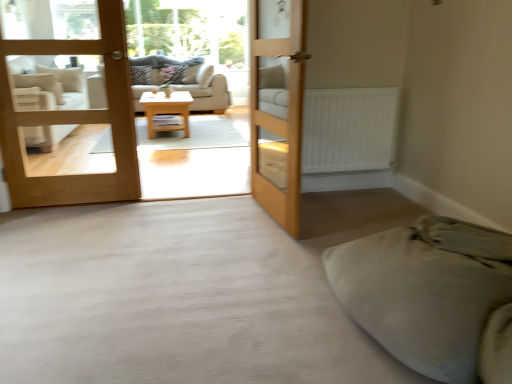
Question: Does light brown wood door at left, the first door from the left, come in front of patterned fabric pillow at center, the first pillow in the left-to-right sequence?

Choices:
 (A) no
 (B) yes

Answer: (B)

Question: Does light brown wood door at left, the first door from the left, have a lesser width compared to patterned fabric pillow at center, the first pillow in the left-to-right sequence?

Choices:
 (A) no
 (B) yes

Answer: (B)

Question: Can you confirm if light brown wood door at left, the first door from the left, is taller than patterned fabric pillow at center, the second pillow in the right-to-left sequence?

Choices:
 (A) yes
 (B) no

Answer: (A)

Question: Is light brown wood door at left, the 2th door when ordered from right to left, oriented towards patterned fabric pillow at center, the second pillow in the right-to-left sequence?

Choices:
 (A) no
 (B) yes

Answer: (A)

Question: From a real-world perspective, is light brown wood door at left, the 2th door when ordered from right to left, on top of patterned fabric pillow at center, the second pillow in the right-to-left sequence?

Choices:
 (A) no
 (B) yes

Answer: (B)

Question: Would you say soft beige blanket at lower right is to the left or to the right of light brown wood door at left, the first door from the left, in the picture?

Choices:
 (A) right
 (B) left

Answer: (A)

Question: Is soft beige blanket at lower right taller or shorter than light brown wood door at left, the first door from the left?

Choices:
 (A) short
 (B) tall

Answer: (A)

Question: From the image's perspective, is soft beige blanket at lower right above or below light brown wood door at left, the first door from the left?

Choices:
 (A) above
 (B) below

Answer: (B)

Question: Is point (399, 299) closer or farther from the camera than point (60, 41)?

Choices:
 (A) farther
 (B) closer

Answer: (B)

Question: Relative to transparent glass window screen at upper center, is white fabric armchair at left in front or behind?

Choices:
 (A) behind
 (B) front

Answer: (B)

Question: Is white fabric armchair at left bigger or smaller than transparent glass window screen at upper center?

Choices:
 (A) small
 (B) big

Answer: (B)

Question: Considering the positions of point (37, 82) and point (132, 34), is point (37, 82) closer or farther from the camera than point (132, 34)?

Choices:
 (A) farther
 (B) closer

Answer: (B)

Question: From a real-world perspective, is white fabric armchair at left positioned above or below transparent glass window screen at upper center?

Choices:
 (A) below
 (B) above

Answer: (A)

Question: Based on their sizes in the image, would you say wooden bunk bed at center is bigger or smaller than soft beige blanket at lower right?

Choices:
 (A) big
 (B) small

Answer: (B)

Question: From the image's perspective, is wooden bunk bed at center positioned above or below soft beige blanket at lower right?

Choices:
 (A) below
 (B) above

Answer: (B)